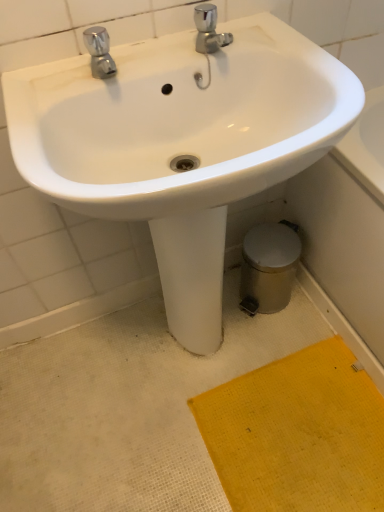
What are the coordinates of `free space that is to the left of yellow textured mat at lower right` in the screenshot? It's located at (140, 418).